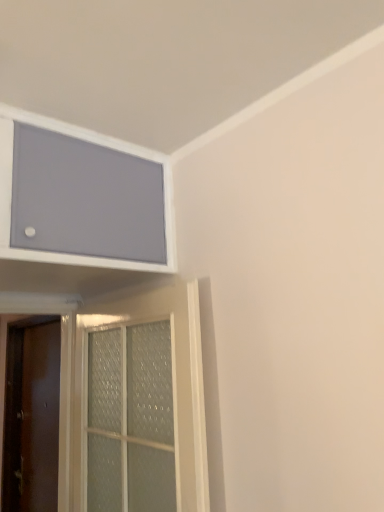
Locate an element on the screen. Image resolution: width=384 pixels, height=512 pixels. clear glass door at lower left, positioned as the 2th door in left-to-right order is located at coordinates (172, 389).

Locate an element on the screen. Image resolution: width=384 pixels, height=512 pixels. clear glass door at lower left, acting as the 2th door starting from the back is located at coordinates (172, 389).

Is matte gray screen at upper left turned away from clear glass door at lower left, which is counted as the first door, starting from the right?

matte gray screen at upper left does not have its back to clear glass door at lower left, which is counted as the first door, starting from the right.

Considering the sizes of matte gray screen at upper left and clear glass door at lower left, which is counted as the first door, starting from the front, in the image, is matte gray screen at upper left bigger or smaller than clear glass door at lower left, which is counted as the first door, starting from the front,?

matte gray screen at upper left is bigger than clear glass door at lower left, which is counted as the first door, starting from the front.

Is matte gray screen at upper left positioned beyond the bounds of clear glass door at lower left, acting as the 2th door starting from the back?

Yes.

Considering the positions of points (45, 132) and (49, 456), is point (45, 132) closer to camera compared to point (49, 456)?

Yes, point (45, 132) is closer to viewer.

Which is in front, matte gray screen at upper left or brown matte door at left, which appears as the second door when viewed from the right?

Positioned in front is matte gray screen at upper left.

From the image's perspective, which object appears higher, matte gray screen at upper left or brown matte door at left, marked as the 1th door in a back-to-front arrangement?

matte gray screen at upper left.

Which of these two, matte gray screen at upper left or brown matte door at left, marked as the 1th door in a back-to-front arrangement, is bigger?

With larger size is matte gray screen at upper left.

Which is behind, point (24, 473) or point (27, 184)?

Positioned behind is point (24, 473).

From the image's perspective, is brown matte door at left, marked as the 1th door in a back-to-front arrangement, located above matte gray screen at upper left?

Actually, brown matte door at left, marked as the 1th door in a back-to-front arrangement, appears below matte gray screen at upper left in the image.

Could you tell me if brown matte door at left, positioned as the 1th door in left-to-right order, is facing matte gray screen at upper left?

No, brown matte door at left, positioned as the 1th door in left-to-right order, is not aimed at matte gray screen at upper left.

Is brown matte door at left, positioned as the 1th door in left-to-right order, in contact with matte gray screen at upper left?

brown matte door at left, positioned as the 1th door in left-to-right order, is not next to matte gray screen at upper left, and they're not touching.

Consider the image. Considering the sizes of brown matte door at left, which appears as the second door when viewed from the right, and clear glass door at lower left, which is counted as the first door, starting from the front, in the image, is brown matte door at left, which appears as the second door when viewed from the right, taller or shorter than clear glass door at lower left, which is counted as the first door, starting from the front,?

Clearly, brown matte door at left, which appears as the second door when viewed from the right, is taller compared to clear glass door at lower left, which is counted as the first door, starting from the front.

Is brown matte door at left, which appears as the second door when viewed from the right, far away from clear glass door at lower left, which is counted as the first door, starting from the front?

brown matte door at left, which appears as the second door when viewed from the right, is actually quite close to clear glass door at lower left, which is counted as the first door, starting from the front.

How far apart are brown matte door at left, positioned as the 1th door in left-to-right order, and clear glass door at lower left, which is counted as the first door, starting from the right?

They are 35.98 inches apart.

Is clear glass door at lower left, acting as the 2th door starting from the back, aimed at matte gray screen at upper left?

No.

Is clear glass door at lower left, positioned as the 2th door in left-to-right order, far away from matte gray screen at upper left?

Actually, clear glass door at lower left, positioned as the 2th door in left-to-right order, and matte gray screen at upper left are a little close together.

Does clear glass door at lower left, acting as the 2th door starting from the back, have a smaller size compared to matte gray screen at upper left?

Yes, clear glass door at lower left, acting as the 2th door starting from the back, is smaller than matte gray screen at upper left.

The image size is (384, 512). In order to click on door on the left of clear glass door at lower left, which is counted as the first door, starting from the front in this screenshot , I will do `click(31, 418)`.

From the image's perspective, is clear glass door at lower left, which is counted as the first door, starting from the right, located above or below brown matte door at left, which appears as the second door when viewed from the right?

clear glass door at lower left, which is counted as the first door, starting from the right, is above brown matte door at left, which appears as the second door when viewed from the right.

Is clear glass door at lower left, positioned as the 2th door in left-to-right order, directly adjacent to brown matte door at left, the second door from the front?

No.

Find the location of a particular element. door that is on the right side of matte gray screen at upper left is located at coordinates 172,389.

This screenshot has height=512, width=384. Find the location of `window screen in front of the brown matte door at left, the second door from the front`. window screen in front of the brown matte door at left, the second door from the front is located at coordinates point(85,199).

Based on their spatial positions, is brown matte door at left, marked as the 1th door in a back-to-front arrangement, or clear glass door at lower left, acting as the 2th door starting from the back, closer to matte gray screen at upper left?

Based on the image, clear glass door at lower left, acting as the 2th door starting from the back, appears to be nearer to matte gray screen at upper left.

Based on their spatial positions, is matte gray screen at upper left or clear glass door at lower left, acting as the 2th door starting from the back, further from brown matte door at left, which appears as the second door when viewed from the right?

Among the two, matte gray screen at upper left is located further to brown matte door at left, which appears as the second door when viewed from the right.

Based on their spatial positions, is clear glass door at lower left, positioned as the 2th door in left-to-right order, or brown matte door at left, positioned as the 1th door in left-to-right order, further from matte gray screen at upper left?

Among the two, brown matte door at left, positioned as the 1th door in left-to-right order, is located further to matte gray screen at upper left.

From the image, which object appears to be farther from brown matte door at left, which appears as the second door when viewed from the right, clear glass door at lower left, which is counted as the first door, starting from the front, or matte gray screen at upper left?

matte gray screen at upper left is further to brown matte door at left, which appears as the second door when viewed from the right.

When comparing their distances from clear glass door at lower left, which is counted as the first door, starting from the right, does matte gray screen at upper left or brown matte door at left, which appears as the second door when viewed from the right, seem further?

Based on the image, brown matte door at left, which appears as the second door when viewed from the right, appears to be further to clear glass door at lower left, which is counted as the first door, starting from the right.

Which object lies further to the anchor point clear glass door at lower left, which is counted as the first door, starting from the front, brown matte door at left, positioned as the 1th door in left-to-right order, or matte gray screen at upper left?

brown matte door at left, positioned as the 1th door in left-to-right order.

Identify the location of door positioned between matte gray screen at upper left and brown matte door at left, marked as the 1th door in a back-to-front arrangement, from near to far. (172, 389).